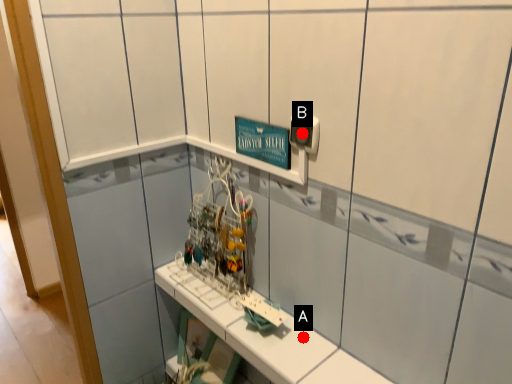
Question: Two points are circled on the image, labeled by A and B beside each circle. Which point is closer to the camera?

Choices:
 (A) A is closer
 (B) B is closer

Answer: (B)